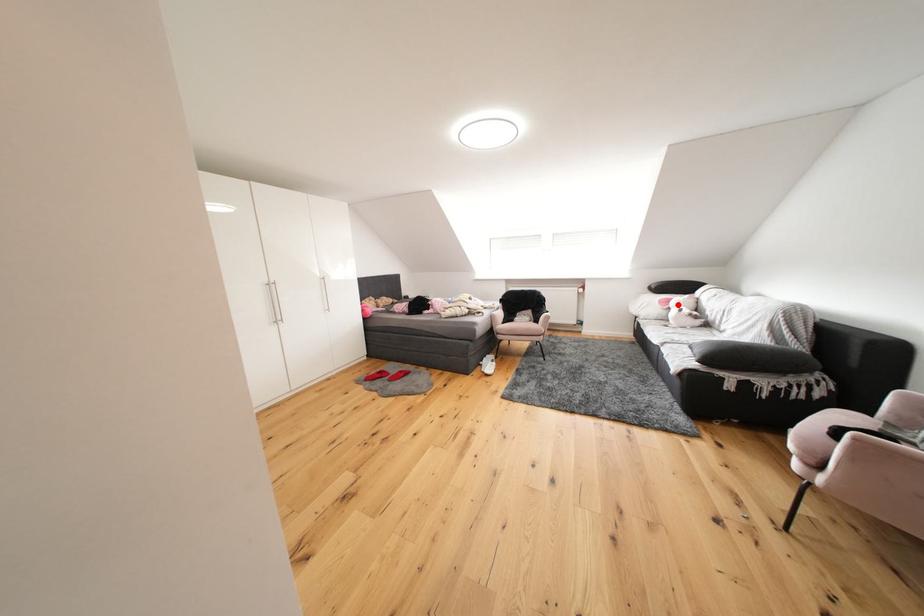
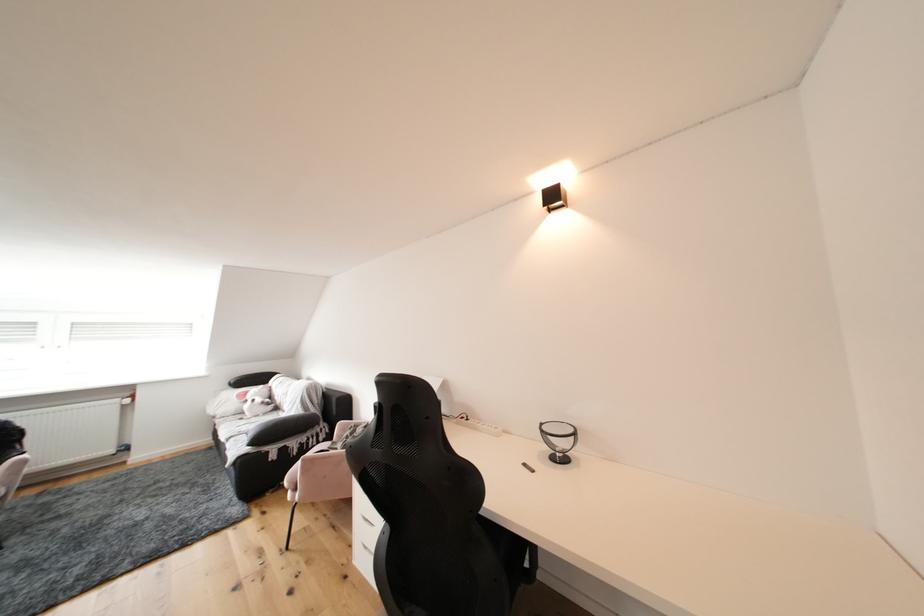
Question: I am providing you with two images of the same scene from different viewpoints. A red point is marked on the first image. At the location where the point appears in image 1, is it still visible in image 2?

Choices:
 (A) Yes
 (B) No

Answer: (A)